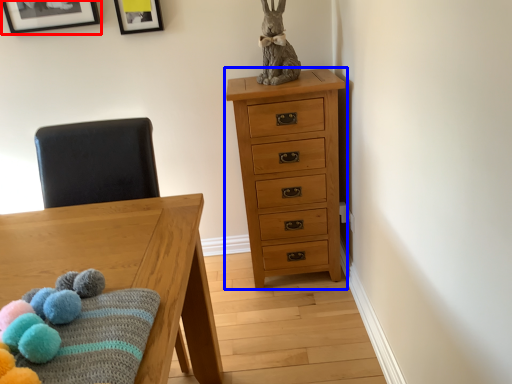
Question: Which object appears farthest to the camera in this image, picture frame (highlighted by a red box) or chest of drawers (highlighted by a blue box)?

Choices:
 (A) picture frame
 (B) chest of drawers

Answer: (A)